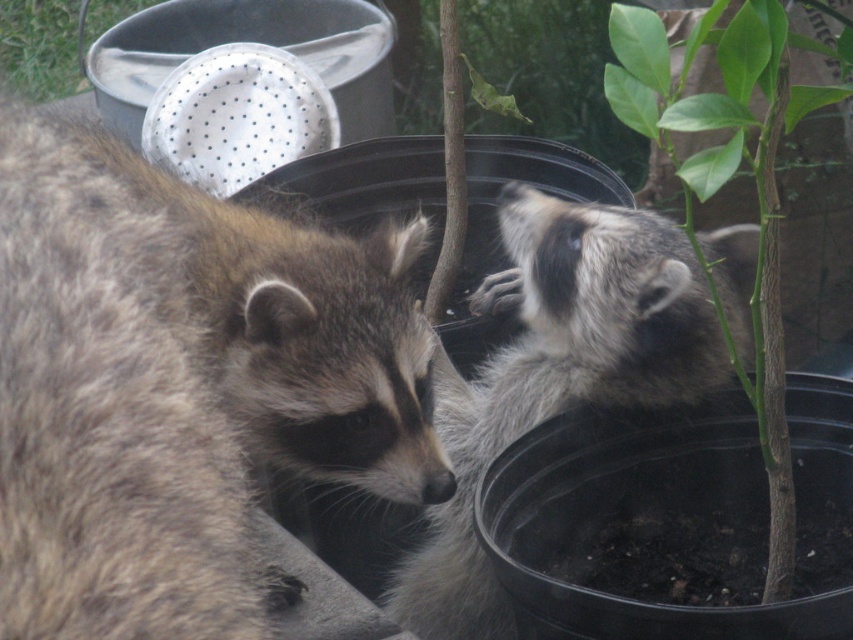
You are a wildlife photographer trying to capture a closeup shot of the raccoons. You have a camera with a 200mm lens that can focus on subjects up to 1 meter away. The fuzzy brown raccoon at left is 0.8 meters from your position, and the fuzzy gray raccoon at center is 1.2 meters away. Can you focus on both raccoons simultaneously with your current settings?

The fuzzy brown raccoon at left is 0.8 meters away, which is within the 1 meter range of the camera lens. The fuzzy gray raccoon at center is 1.2 meters away, which exceeds the maximum focusing distance of 1 meter. Therefore, you can focus on the fuzzy brown raccoon at left but not the fuzzy gray raccoon at center simultaneously with the current settings.

Looking at this image, you are a photographer trying to capture a closeup shot of the raccoon on the left. You notice two points in the scene marked as point 1 at coordinates point [346,262] and point 2 at coordinates point [10,77]. Which point should you focus on to ensure the raccoon on the left is in sharp focus?

Point [346,262] is closer to the camera than point [10,77], so you should focus on point [346,262] to ensure the raccoon on the left is in sharp focus.

You are a photographer trying to capture a closeup of the fuzzy gray raccoon at center. The metallic silver colander at upper left is blocking your view. Can you estimate if the raccoon is narrower than the colander, allowing you to move it sideways without needing to lift it?

The fuzzy gray raccoon at center is thinner than the metallic silver colander at upper left, so it can be moved sideways to allow the photographer to capture the closeup without needing to lift the colander.